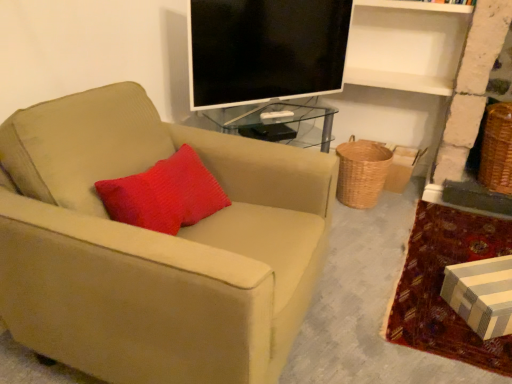
Question: From a real-world perspective, relative to suede beige armchair at left, is black glossy tv at upper center vertically above or below?

Choices:
 (A) above
 (B) below

Answer: (A)

Question: Considering the relative positions of black glossy tv at upper center and suede beige armchair at left in the image provided, is black glossy tv at upper center to the left or to the right of suede beige armchair at left?

Choices:
 (A) left
 (B) right

Answer: (B)

Question: Based on their relative distances, which object is farther from the suede beige armchair at left?

Choices:
 (A) striped cardboard box at lower right
 (B) brown woven basket at lower right, positioned as the first basket in right-to-left order
 (C) woven brown basket at lower right, placed as the 2th basket when sorted from right to left
 (D) black glossy tv at upper center
 (E) striped cardboard box at lower right

Answer: (B)

Question: Which object is positioned closest to the brown woven basket at lower right, positioned as the first basket in right-to-left order?

Choices:
 (A) striped cardboard box at lower right
 (B) striped cardboard box at lower right
 (C) black glossy tv at upper center
 (D) woven brown basket at lower right, placed as the 2th basket when sorted from right to left
 (E) suede beige armchair at left

Answer: (B)